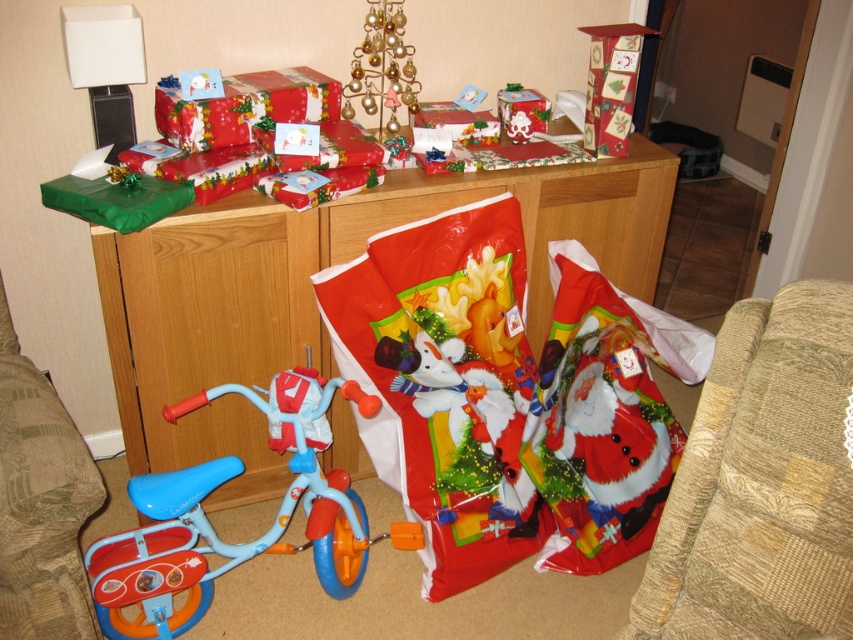
Question: Estimate the real-world distances between objects in this image. Which object is farther from the beige fabric armchair at lower right?

Choices:
 (A) light blue plastic bicycle at lower left
 (B) textured beige armchair at lower left

Answer: (B)

Question: In this image, where is light blue plastic bicycle at lower left located relative to textured beige armchair at lower left?

Choices:
 (A) below
 (B) above

Answer: (A)

Question: Which point appears closest to the camera in this image?

Choices:
 (A) (16, 557)
 (B) (158, 628)
 (C) (619, 272)

Answer: (A)

Question: Estimate the real-world distances between objects in this image. Which object is closer to the beige fabric armchair at lower right?

Choices:
 (A) wooden cabinet at center
 (B) light blue plastic bicycle at lower left
 (C) textured beige armchair at lower left

Answer: (B)

Question: From the image, what is the correct spatial relationship of wooden cabinet at center in relation to beige fabric armchair at lower right?

Choices:
 (A) right
 (B) left

Answer: (B)

Question: Does beige fabric armchair at lower right appear under textured beige armchair at lower left?

Choices:
 (A) no
 (B) yes

Answer: (B)